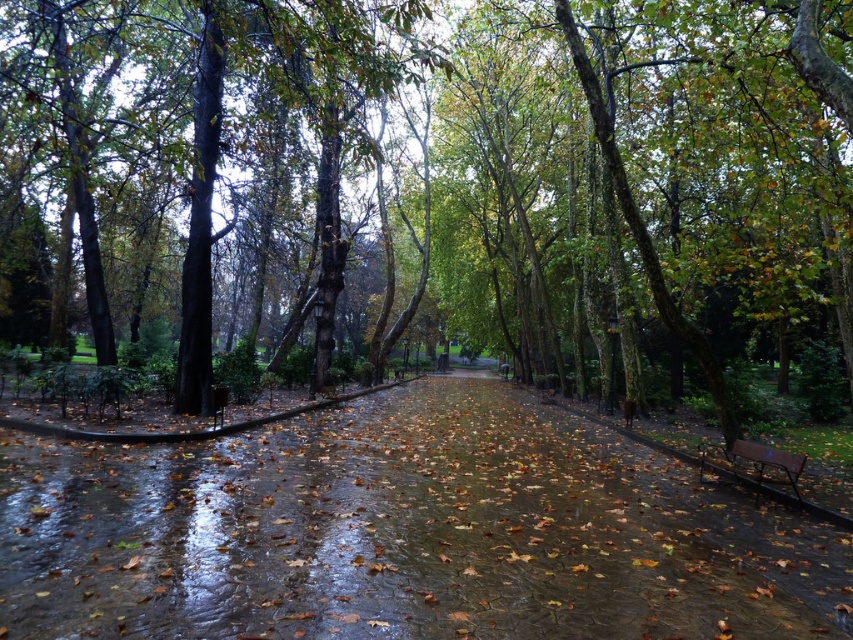
Question: Which point is farther to the camera?

Choices:
 (A) wet concrete path at center
 (B) green leafy tree at center
 (C) brown wooden bench at lower right

Answer: (C)

Question: Is wet concrete path at center further to camera compared to brown wooden bench at lower right?

Choices:
 (A) no
 (B) yes

Answer: (A)

Question: Is green leafy tree at center to the right of wet concrete path at center from the viewer's perspective?

Choices:
 (A) yes
 (B) no

Answer: (A)

Question: Among these points, which one is farthest from the camera?

Choices:
 (A) pyautogui.click(x=796, y=454)
 (B) pyautogui.click(x=592, y=461)

Answer: (B)

Question: Is wet concrete path at center to the right of brown wooden bench at lower right from the viewer's perspective?

Choices:
 (A) yes
 (B) no

Answer: (B)

Question: Which object appears closest to the camera in this image?

Choices:
 (A) green leafy tree at center
 (B) brown wooden bench at lower right
 (C) wet concrete path at center

Answer: (C)